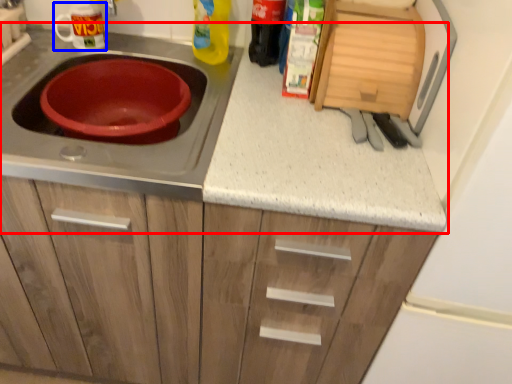
Question: Which object appears farthest to the camera in this image, countertop (highlighted by a red box) or appliance (highlighted by a blue box)?

Choices:
 (A) countertop
 (B) appliance

Answer: (B)